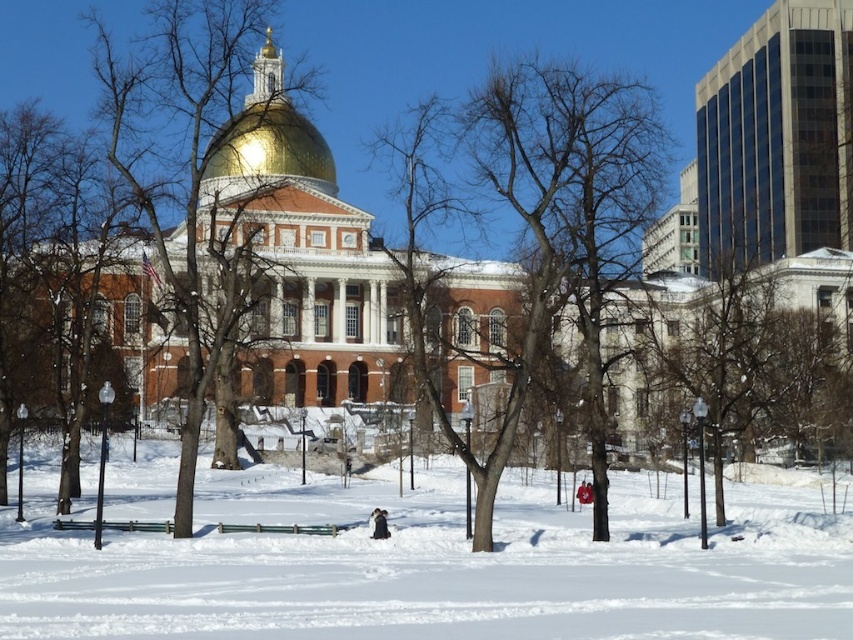
You are standing in the snow covered park in front of the golden dome building. You see two points marked on the ground, point A at coordinates point [138,179] and point B at coordinates point [148,529]. Which point is closer to you?

Point A at coordinates point [138,179] is closer to you because it is further to the viewer than point B at coordinates point [148,529].

You are standing in the winter park and see the white powdery snow at center and the gold metallic dome at center. Which object is closer to you?

The white powdery snow at center is closer to you because it is positioned under the gold metallic dome at center, meaning the snow is in the foreground while the dome is part of the background structure.

You are planning to build a snowman using the white powdery snow at center and need to sit on the wooden park bench at lower center while doing so. Is there enough snow to build a medium sized snowman and space to sit on the bench?

The white powdery snow at center has a larger size compared to wooden park bench at lower center, so there is enough snow to build a medium sized snowman and space to sit on the bench.